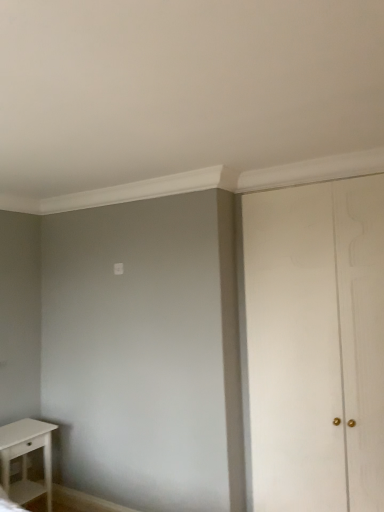
Question: Considering the positions of point (x=44, y=451) and point (x=276, y=459), is point (x=44, y=451) closer or farther from the camera than point (x=276, y=459)?

Choices:
 (A) closer
 (B) farther

Answer: (B)

Question: From a real-world perspective, relative to white wood door at right, is white matte table at lower left vertically above or below?

Choices:
 (A) above
 (B) below

Answer: (B)

Question: In terms of height, does white matte table at lower left look taller or shorter compared to white wood door at right?

Choices:
 (A) short
 (B) tall

Answer: (A)

Question: From the image's perspective, is white wood door at right above or below white matte table at lower left?

Choices:
 (A) above
 (B) below

Answer: (A)

Question: Would you say white wood door at right is to the left or to the right of white matte table at lower left in the picture?

Choices:
 (A) right
 (B) left

Answer: (A)

Question: Looking at the image, does white wood door at right seem bigger or smaller compared to white matte table at lower left?

Choices:
 (A) small
 (B) big

Answer: (B)

Question: Is point (279, 445) closer or farther from the camera than point (49, 470)?

Choices:
 (A) farther
 (B) closer

Answer: (B)